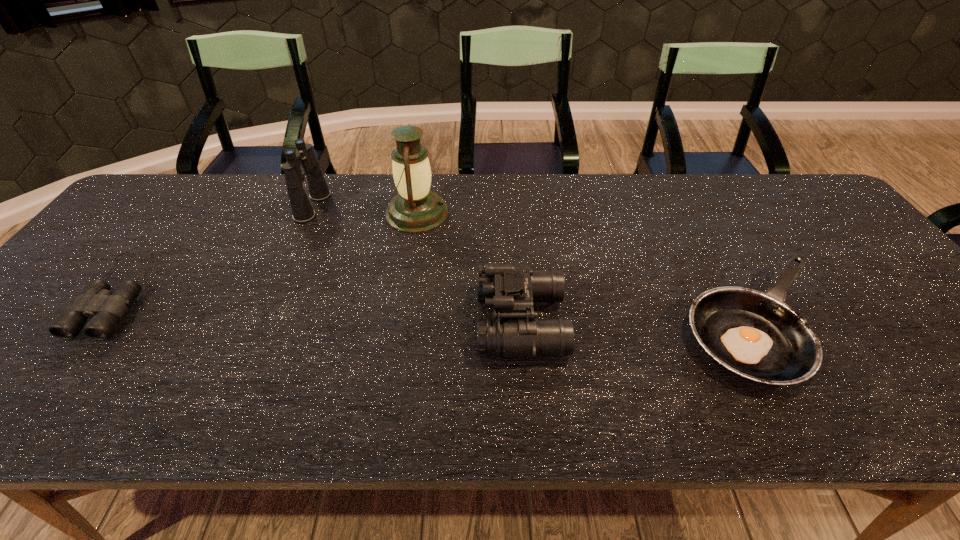
This screenshot has height=540, width=960. I want to click on free space between the lantern and the leftmost binoculars, so click(269, 253).

The height and width of the screenshot is (540, 960). I want to click on unoccupied position between the lantern and the leftmost object, so click(x=269, y=253).

Locate an element on the screen. This screenshot has height=540, width=960. empty location between the rightmost object and the second object from right to left is located at coordinates (638, 323).

Where is `vacant region between the leftmost object and the lantern`? vacant region between the leftmost object and the lantern is located at coordinates (269, 253).

At what (x,y) coordinates should I click in order to perform the action: click on free space between the third object from right to left and the fourth object from left to right. Please return your answer as a coordinate pair (x, y). The image size is (960, 540). Looking at the image, I should click on (469, 268).

Image resolution: width=960 pixels, height=540 pixels. What are the coordinates of `free space between the fourth object from left to right and the frying pan` in the screenshot? It's located at (638, 323).

The width and height of the screenshot is (960, 540). Find the location of `vacant area that lies between the lantern and the second shortest binoculars`. vacant area that lies between the lantern and the second shortest binoculars is located at coordinates (469, 268).

Select which object is the third closest to the frying pan. Please provide its 2D coordinates. Your answer should be formatted as a tuple, i.e. [(x, y)], where the tuple contains the x and y coordinates of a point satisfying the conditions above.

[(302, 210)]

Identify which object is located as the fourth nearest to the rightmost object. Please provide its 2D coordinates. Your answer should be formatted as a tuple, i.e. [(x, y)], where the tuple contains the x and y coordinates of a point satisfying the conditions above.

[(96, 301)]

This screenshot has height=540, width=960. What are the coordinates of `binoculars that is the second closest to the frying pan` in the screenshot? It's located at (302, 210).